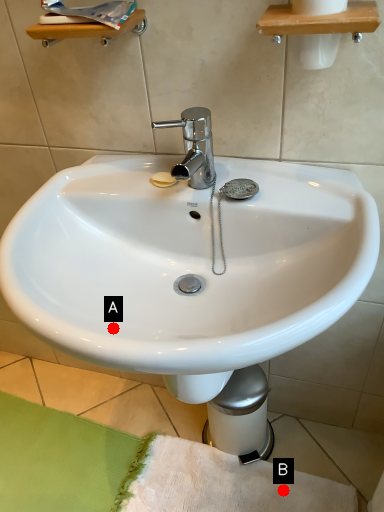
Question: Two points are circled on the image, labeled by A and B beside each circle. Which point is closer to the camera?

Choices:
 (A) A is closer
 (B) B is closer

Answer: (A)